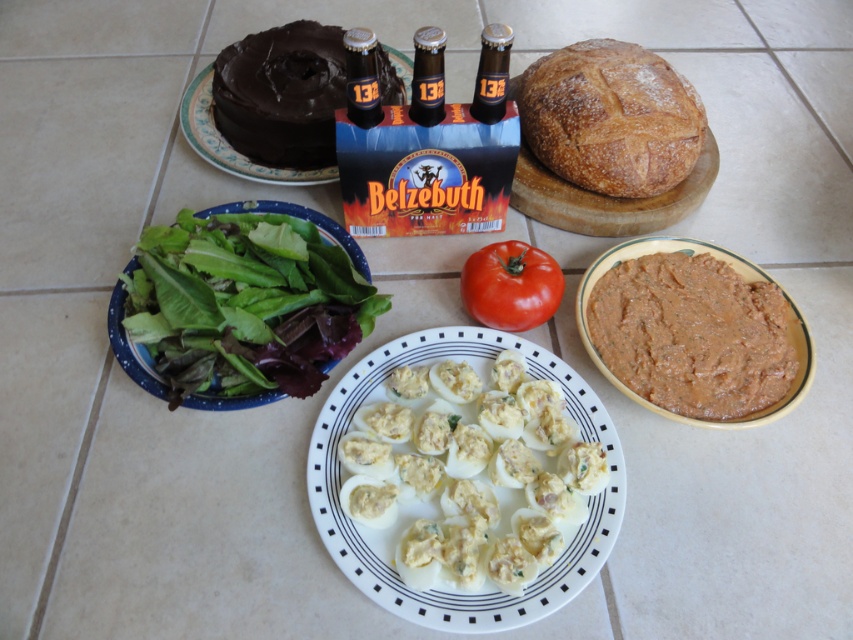
Who is taller, white creamy deviled eggs at center or green leafymaterial/texturevegetable at left?

Standing taller between the two is green leafymaterial/texturevegetable at left.

Is point (544, 570) behind point (233, 273)?

No, it is in front of (233, 273).

Locate an element on the screen. This screenshot has width=853, height=640. white creamy deviled eggs at center is located at coordinates (469, 476).

This screenshot has width=853, height=640. In order to click on white creamy deviled eggs at center in this screenshot , I will do `click(469, 476)`.

Is point (709, 332) closer to viewer compared to point (572, 88)?

Yes, point (709, 332) is closer to viewer.

Does brown creamy dip at lower right appear on the right side of golden brown crusty loaf of bread at upper right?

Yes, brown creamy dip at lower right is to the right of golden brown crusty loaf of bread at upper right.

What do you see at coordinates (692, 333) in the screenshot?
I see `brown creamy dip at lower right` at bounding box center [692, 333].

Locate an element on the screen. This screenshot has height=640, width=853. brown creamy dip at lower right is located at coordinates (692, 333).

Who is shorter, brown creamy dip at lower right or red matte tomato at center?

Standing shorter between the two is red matte tomato at center.

This screenshot has width=853, height=640. What do you see at coordinates (692, 333) in the screenshot?
I see `brown creamy dip at lower right` at bounding box center [692, 333].

Who is more distant from viewer, (677, 385) or (503, 272)?

The point (503, 272) is behind.

The width and height of the screenshot is (853, 640). Identify the location of brown creamy dip at lower right. (692, 333).